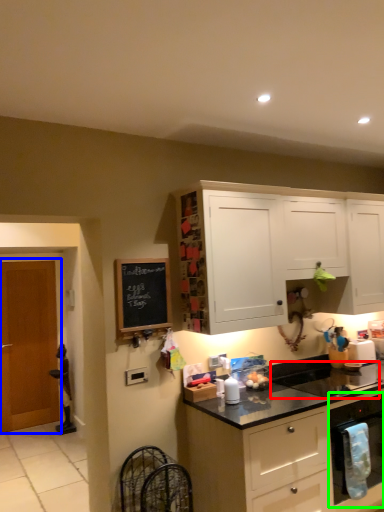
Question: Which is farther away from sink (highlighted by a red box)? door (highlighted by a blue box) or kitchen appliance (highlighted by a green box)?

Choices:
 (A) door
 (B) kitchen appliance

Answer: (A)